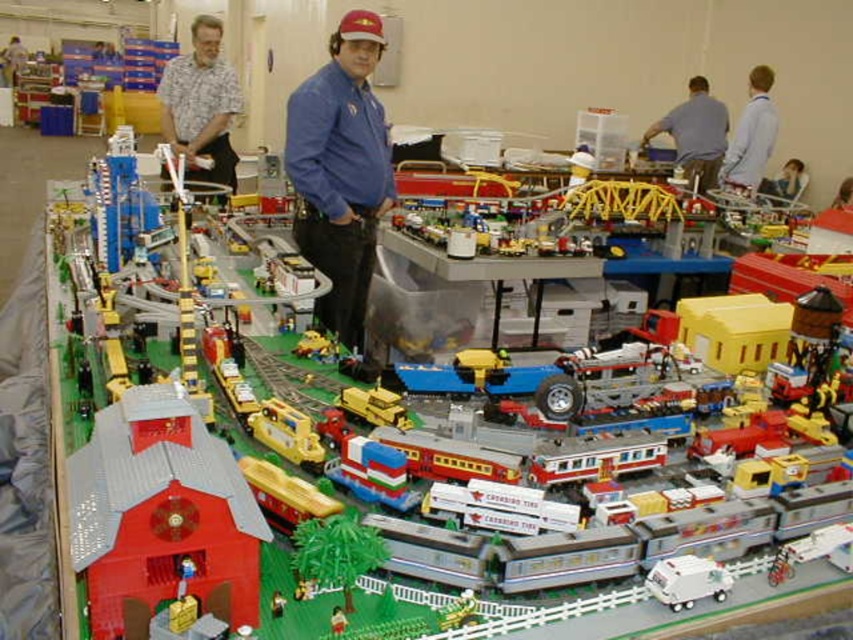
Question: Which object is farther from the camera taking this photo?

Choices:
 (A) brushed metal shirt at upper left
 (B) blue shirt at upper right
 (C) brick red train at center
 (D) blue cotton shirt at center

Answer: (B)

Question: Which object appears farthest from the camera in this image?

Choices:
 (A) brick red train at center
 (B) blue cotton shirt at center
 (C) blue shirt at upper right
 (D) brushed metal water at bottle left

Answer: (D)

Question: Is blue cotton shirt at center positioned before brick red train at center?

Choices:
 (A) yes
 (B) no

Answer: (B)

Question: Which point appears closest to the camera in this image?

Choices:
 (A) (210, 600)
 (B) (688, 99)

Answer: (A)

Question: Is blue cotton shirt at center in front of brushed metal shirt at upper left?

Choices:
 (A) no
 (B) yes

Answer: (B)

Question: Does brick red barn at lower left appear under brushed metal shirt at upper left?

Choices:
 (A) no
 (B) yes

Answer: (B)